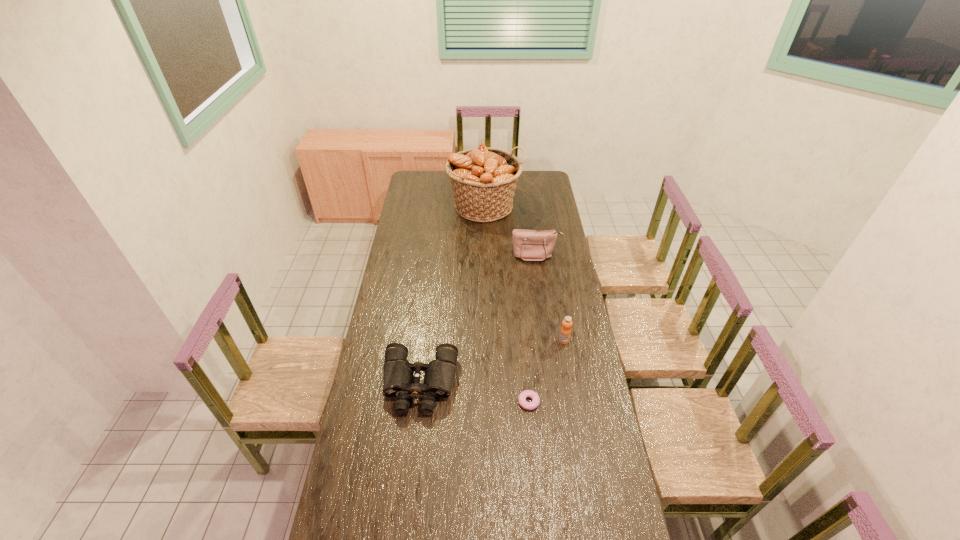
Where is `free space located on the right of the doughnut`? The width and height of the screenshot is (960, 540). free space located on the right of the doughnut is located at coordinates pos(565,402).

Identify the location of object that is at the far edge. The width and height of the screenshot is (960, 540). [x=483, y=179].

You are a GUI agent. You are given a task and a screenshot of the screen. Output one action in this format:
    pyautogui.click(x=<x>, y=<y>)
    Task: Click on the object located in the left edge section of the desktop
    This screenshot has width=960, height=540.
    Given the screenshot: What is the action you would take?
    pyautogui.click(x=398, y=373)

Where is `shoulder bag that is at the right edge`? This screenshot has height=540, width=960. shoulder bag that is at the right edge is located at coordinates (529, 245).

This screenshot has height=540, width=960. I want to click on orange juice located in the right edge section of the desktop, so click(565, 332).

This screenshot has width=960, height=540. In the image, there is a desktop. What are the coordinates of `vacant space at the far edge` in the screenshot? It's located at (446, 177).

This screenshot has width=960, height=540. Identify the location of free point at the left edge. (423, 225).

This screenshot has height=540, width=960. What are the coordinates of `blank space at the right edge of the desktop` in the screenshot? It's located at (582, 406).

Find the location of a particular element. The width and height of the screenshot is (960, 540). vacant space that is in between the fourth nearest object and the tallest object is located at coordinates (511, 231).

You are a GUI agent. You are given a task and a screenshot of the screen. Output one action in this format:
    pyautogui.click(x=<x>, y=<y>)
    Task: Click on the free spot between the second shortest object and the farthest object
    The height and width of the screenshot is (540, 960).
    Given the screenshot: What is the action you would take?
    coord(453,295)